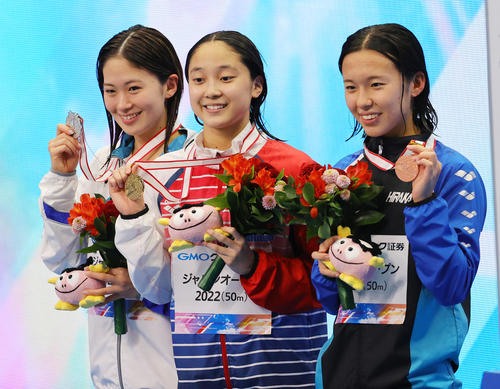
Identify the location of toys animal stuffed. Image resolution: width=500 pixels, height=389 pixels. (72, 293), (194, 223), (362, 267).